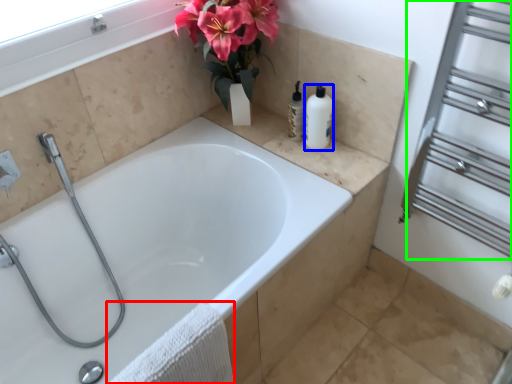
Question: Which object is the farthest from bath towel (highlighted by a red box)? Choose among these: soap dispenser (highlighted by a blue box) or screen door (highlighted by a green box).

Choices:
 (A) soap dispenser
 (B) screen door

Answer: (B)